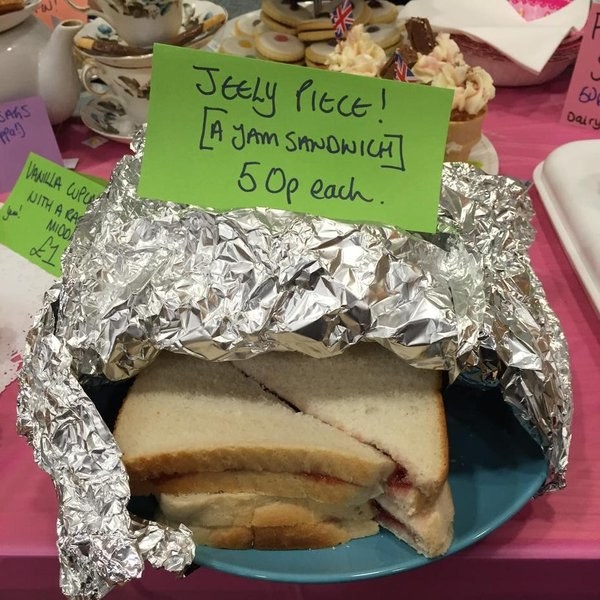
Identify the location of plate. Image resolution: width=600 pixels, height=600 pixels. click(375, 570), click(508, 466).